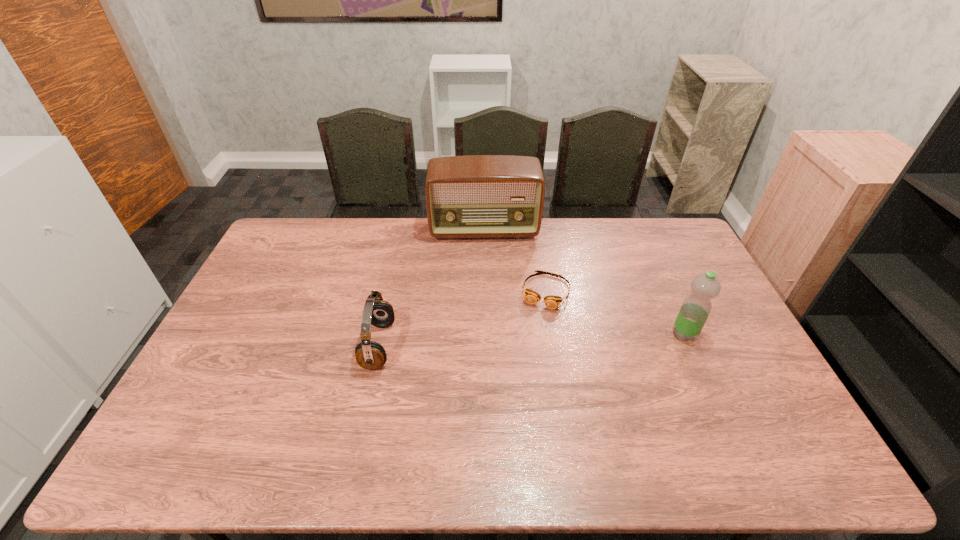
At what (x,y) coordinates should I click in order to perform the action: click on vacant space positioned on the back of the rightmost object. Please return your answer as a coordinate pair (x, y). Looking at the image, I should click on (649, 255).

The height and width of the screenshot is (540, 960). In order to click on vacant space situated on the front-facing side of the radio receiver in this screenshot , I will do [489, 304].

Identify the location of free space located on the front-facing side of the radio receiver. (487, 275).

Locate an element on the screen. The width and height of the screenshot is (960, 540). blank space located on the front-facing side of the radio receiver is located at coordinates (489, 308).

In order to click on vacant space located 0.260m with the lenses facing forward on the shortest object in this screenshot , I will do `click(518, 375)`.

Image resolution: width=960 pixels, height=540 pixels. I want to click on vacant position located with the lenses facing forward on the shortest object, so click(x=520, y=369).

Identify the location of vacant point located 0.340m with the lenses facing forward on the shortest object. (510, 399).

Image resolution: width=960 pixels, height=540 pixels. In order to click on object located at the far edge in this screenshot , I will do `click(475, 196)`.

This screenshot has width=960, height=540. Find the location of `object at the right edge`. object at the right edge is located at coordinates (696, 307).

You are a GUI agent. You are given a task and a screenshot of the screen. Output one action in this format:
    pyautogui.click(x=<x>, y=<y>)
    Task: Click on the free region at the far edge of the desktop
    This screenshot has width=960, height=540.
    Given the screenshot: What is the action you would take?
    pyautogui.click(x=589, y=248)